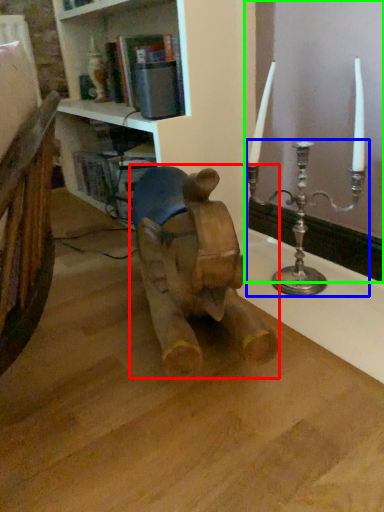
Question: Based on their relative distances, which object is nearer to animal (highlighted by a red box)? Choose from candle holder (highlighted by a blue box) and window frame (highlighted by a green box).

Choices:
 (A) candle holder
 (B) window frame

Answer: (A)